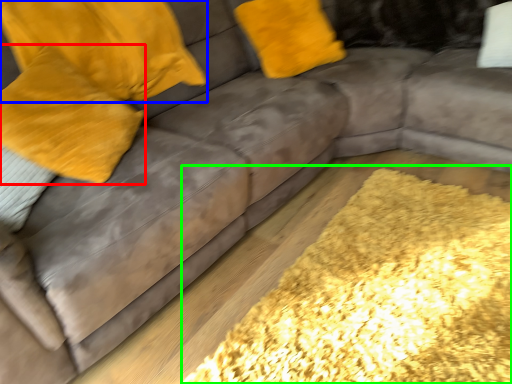
Question: Which object is positioned farthest from pillow (highlighted by a red box)? Select from pillow (highlighted by a blue box) and mat (highlighted by a green box).

Choices:
 (A) pillow
 (B) mat

Answer: (B)